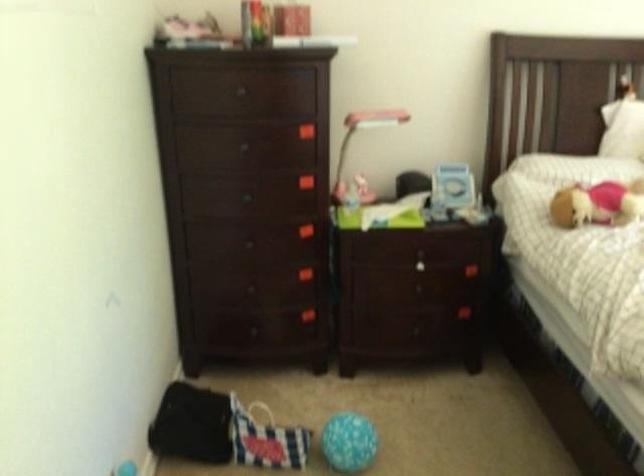
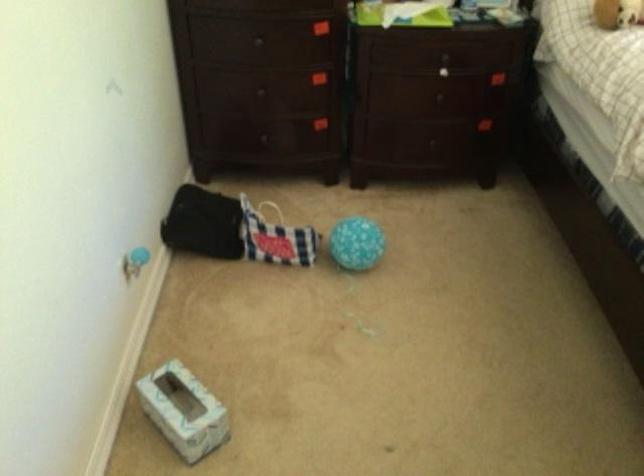
Find the pixel in the second image that matches the point at 245,289 in the first image.

(260, 90)